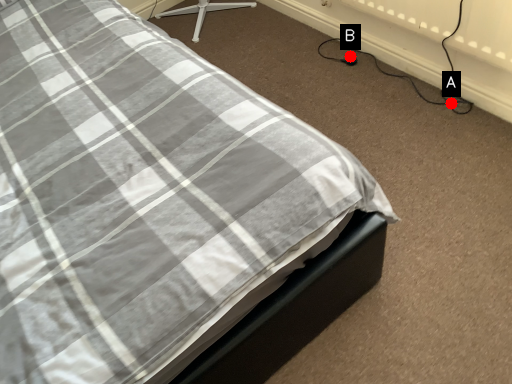
Question: Two points are circled on the image, labeled by A and B beside each circle. Which point appears closest to the camera in this image?

Choices:
 (A) A is closer
 (B) B is closer

Answer: (A)